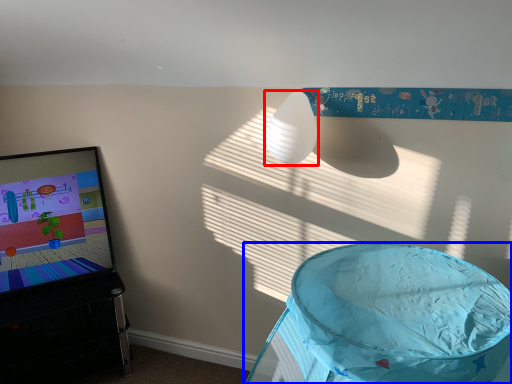
Question: Among these objects, which one is nearest to the camera, lamp (highlighted by a red box) or furniture (highlighted by a blue box)?

Choices:
 (A) lamp
 (B) furniture

Answer: (B)